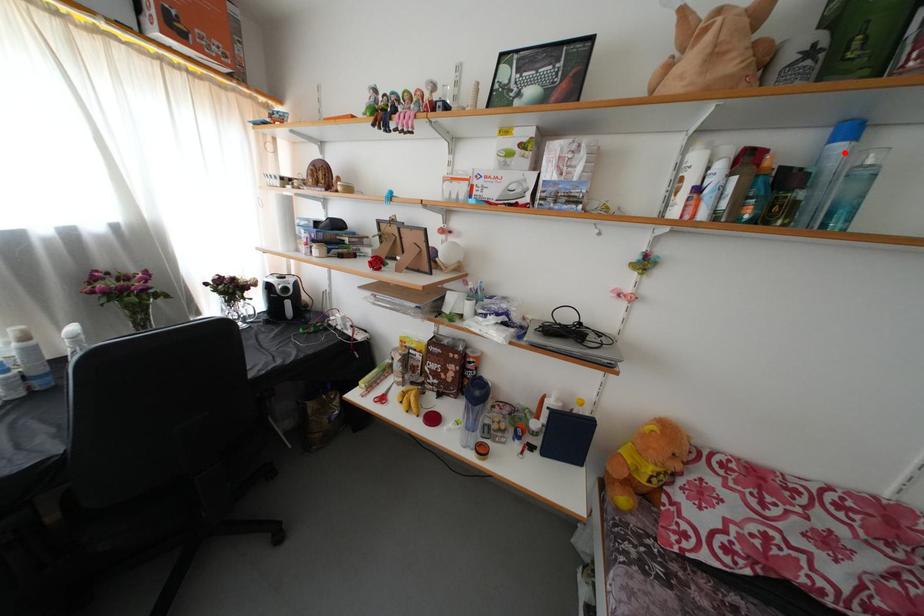
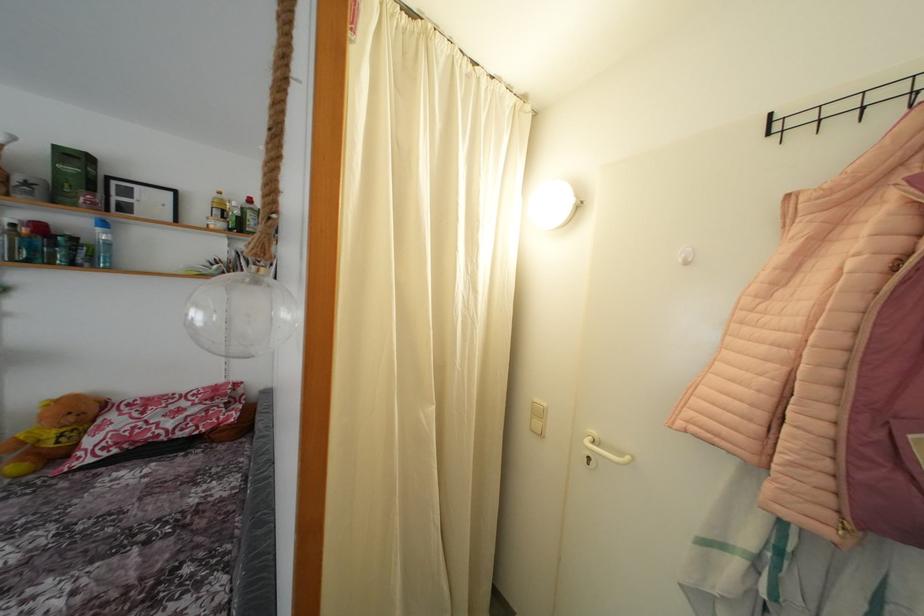
In the second image, find the point that corresponds to the highlighted location in the first image.

(104, 236)